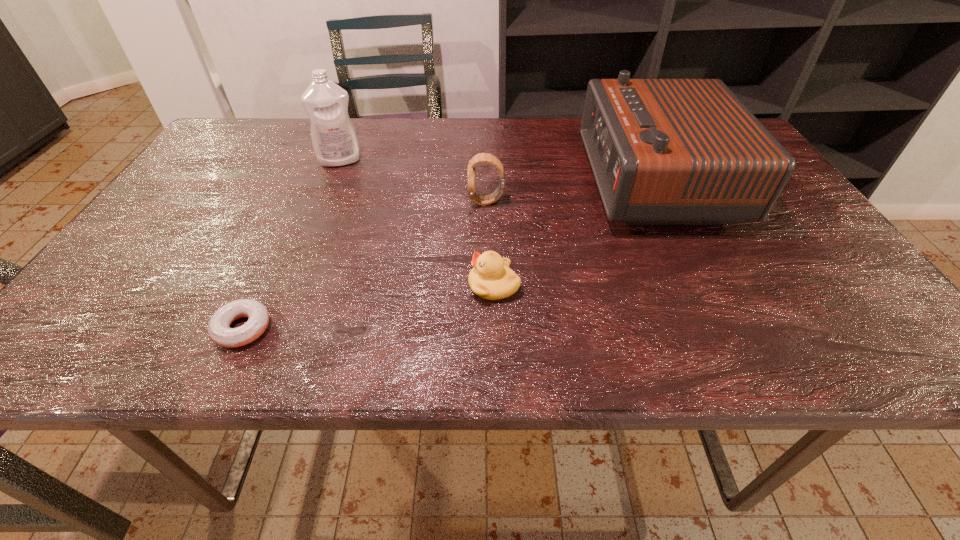
Locate an element on the screen. The width and height of the screenshot is (960, 540). object present at the near edge is located at coordinates (219, 330).

Where is `object present at the right edge`? This screenshot has width=960, height=540. object present at the right edge is located at coordinates (663, 151).

Image resolution: width=960 pixels, height=540 pixels. In order to click on object that is positioned at the far right corner in this screenshot , I will do `click(663, 151)`.

Where is `vacant space at the far edge`? The height and width of the screenshot is (540, 960). vacant space at the far edge is located at coordinates click(x=389, y=161).

I want to click on vacant space at the near edge of the desktop, so click(674, 329).

The width and height of the screenshot is (960, 540). Find the location of `vacant point at the left edge`. vacant point at the left edge is located at coordinates (187, 278).

Identify the location of free space at the right edge. Image resolution: width=960 pixels, height=540 pixels. (786, 278).

Where is `free region at the near left corner of the desktop`? This screenshot has width=960, height=540. free region at the near left corner of the desktop is located at coordinates (72, 325).

What are the coordinates of `vacant area that lies between the shortest object and the fourth farthest object` in the screenshot? It's located at click(x=369, y=307).

You are a GUI agent. You are given a task and a screenshot of the screen. Output one action in this format:
    pyautogui.click(x=<x>, y=<y>)
    Task: Click on the free space that is in between the detergent and the watch
    The image size is (960, 540).
    Given the screenshot: What is the action you would take?
    pyautogui.click(x=413, y=181)